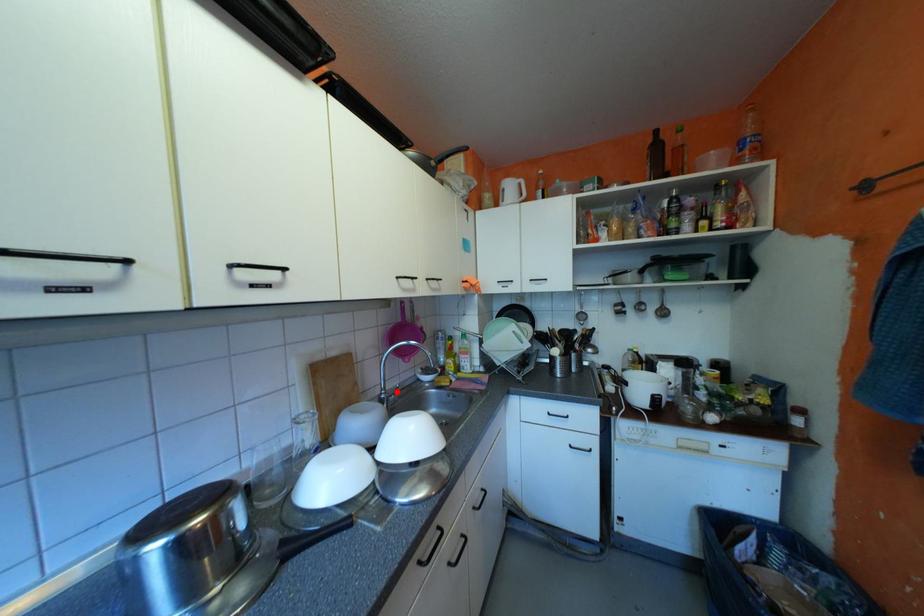
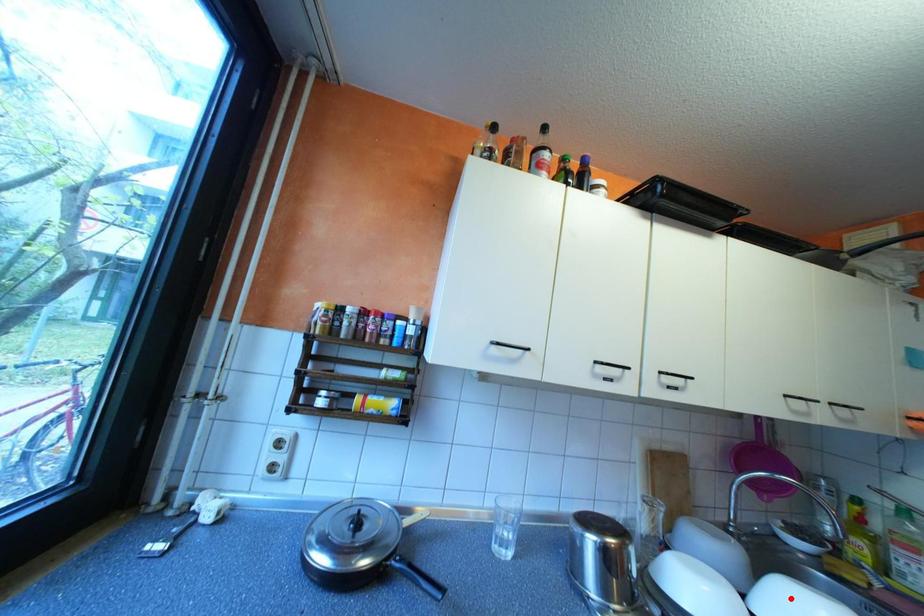
I am providing you with two images of the same scene from different viewpoints. A red point is marked on the first image and another point is marked on the second image. Does the point marked in image1 correspond to the same location as the one in image2?

No